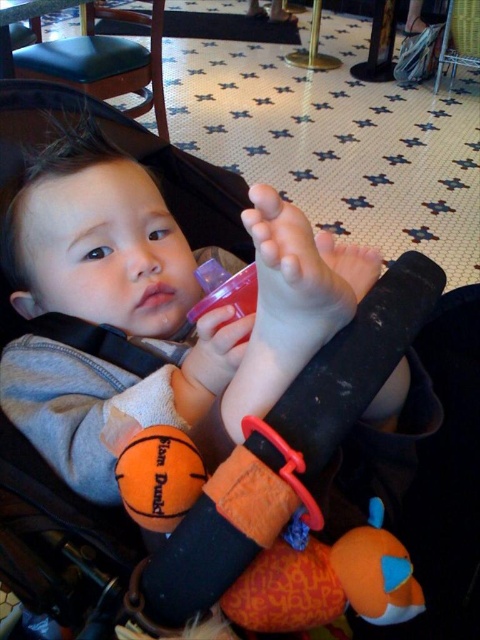
Does point (132, 230) lie in front of point (369, 522)?

No.

Does matte gray baby at center come behind orange plush toy at center?

No, matte gray baby at center is in front of orange plush toy at center.

The width and height of the screenshot is (480, 640). I want to click on matte gray baby at center, so click(x=155, y=307).